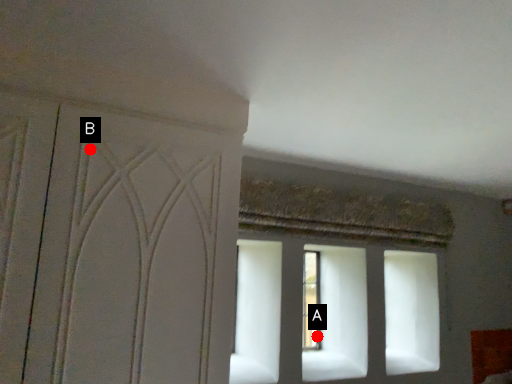
Question: Two points are circled on the image, labeled by A and B beside each circle. Which point is closer to the camera taking this photo?

Choices:
 (A) A is closer
 (B) B is closer

Answer: (B)